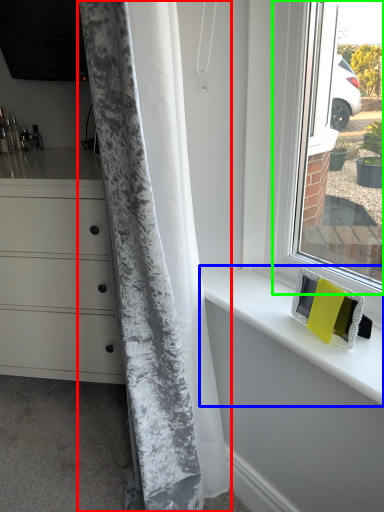
Question: Which object is positioned farthest from curtain (highlighted by a red box)? Select from counter top (highlighted by a blue box) and window (highlighted by a green box).

Choices:
 (A) counter top
 (B) window

Answer: (B)